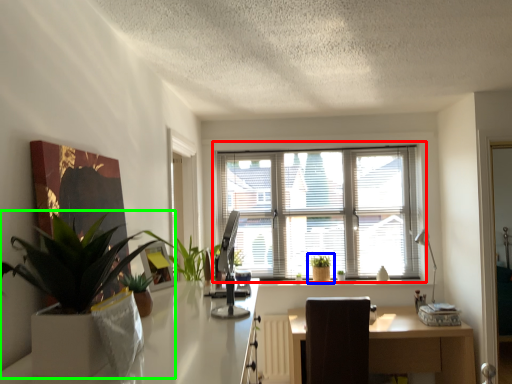
Question: Which object is positioned farthest from window (highlighted by a red box)? Select from houseplant (highlighted by a blue box) and houseplant (highlighted by a green box).

Choices:
 (A) houseplant
 (B) houseplant

Answer: (B)